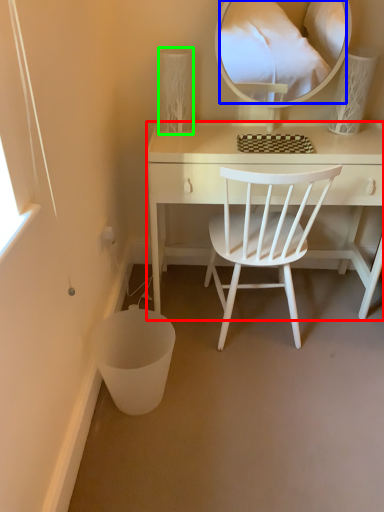
Question: Considering the real-world distances, which object is closest to desk (highlighted by a red box)? mirror (highlighted by a blue box) or table lamp (highlighted by a green box).

Choices:
 (A) mirror
 (B) table lamp

Answer: (B)